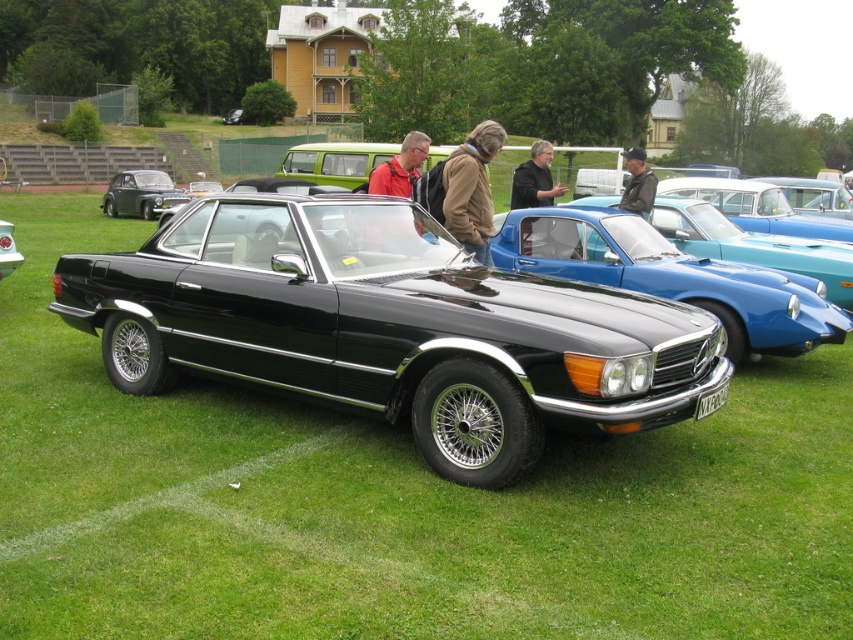
You are a photographer at the car show and want to capture both the brown leather jacket at center and the shiny black car at left in a single frame. Based on their sizes, which object will appear smaller in the photo?

The brown leather jacket at center will appear smaller in the photo because it has a lesser width compared to the shiny black car at left.